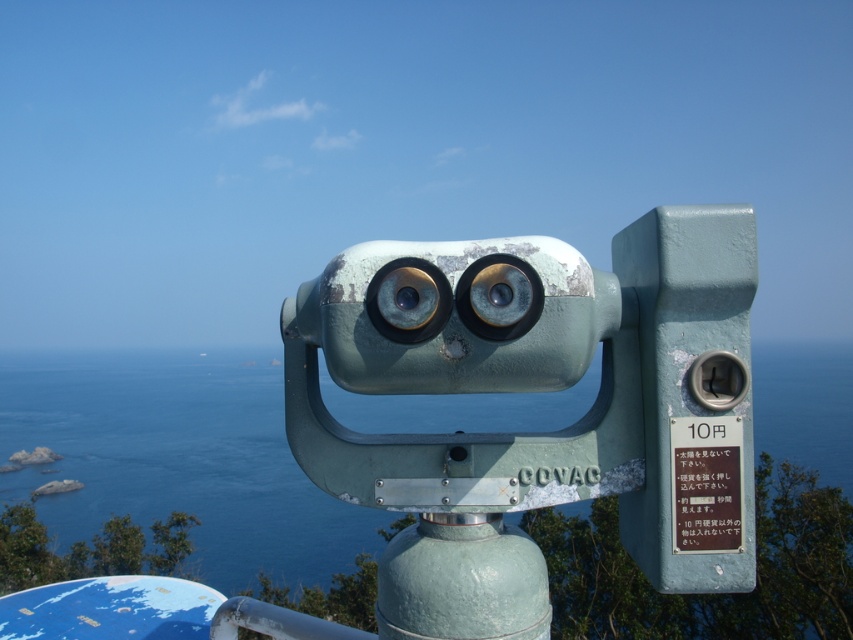
Question: In this image, where is green patina telescope at center located relative to blue water at center?

Choices:
 (A) above
 (B) below

Answer: (A)

Question: Which of the following is the closest to the observer?

Choices:
 (A) blue water at center
 (B) green patina telescope at center

Answer: (B)

Question: Which of the following is the closest to the observer?

Choices:
 (A) (561, 356)
 (B) (115, 497)

Answer: (A)

Question: Can you confirm if green patina telescope at center is wider than blue water at center?

Choices:
 (A) no
 (B) yes

Answer: (A)

Question: Which object is closer to the camera taking this photo?

Choices:
 (A) blue water at center
 (B) green patina telescope at center

Answer: (B)

Question: Does green patina telescope at center appear under blue water at center?

Choices:
 (A) no
 (B) yes

Answer: (A)